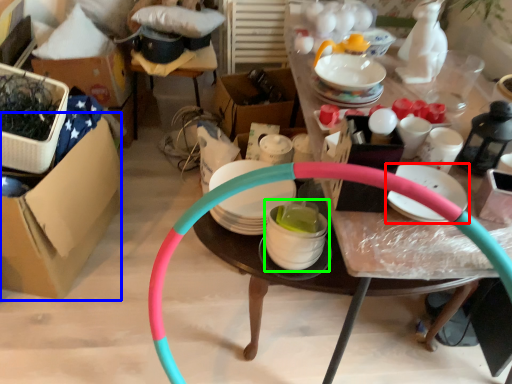
Question: Considering the real-world distances, which object is closest to tableware (highlighted by a red box)? cardboard box (highlighted by a blue box) or tableware (highlighted by a green box).

Choices:
 (A) cardboard box
 (B) tableware

Answer: (B)